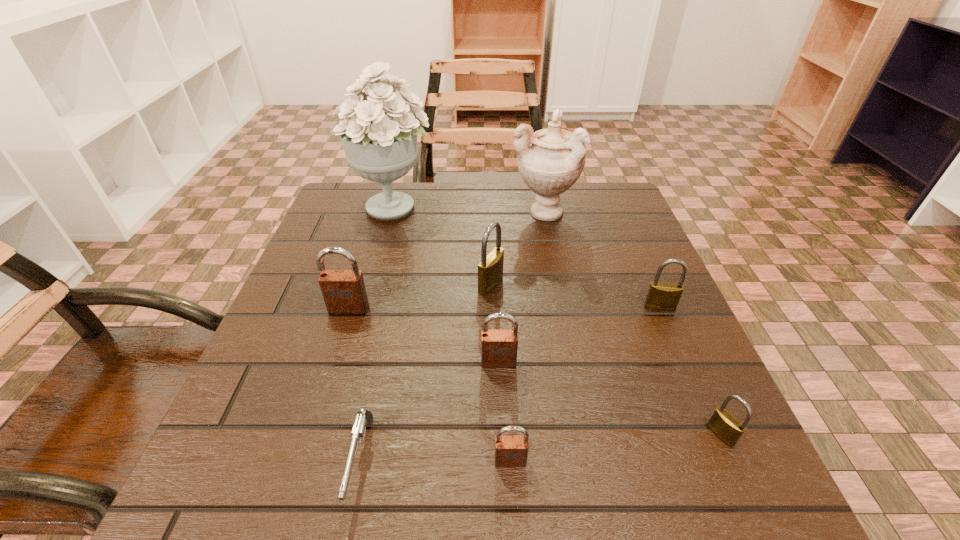
I want to click on object that stands as the seventh closest to the seventh nearest object, so click(510, 451).

Identify which object is located as the eighth nearest to the shortest object. Please provide its 2D coordinates. Your answer should be formatted as a tuple, i.e. [(x, y)], where the tuple contains the x and y coordinates of a point satisfying the conditions above.

[(550, 161)]

Find the location of a particular element. The height and width of the screenshot is (540, 960). padlock that is the closest to the pistol is located at coordinates (510, 451).

Where is `the fourth closest padlock to the green bouquet`? The width and height of the screenshot is (960, 540). the fourth closest padlock to the green bouquet is located at coordinates (661, 296).

Find the location of a particular element. This screenshot has width=960, height=540. brass padlock that is the closest to the biggest brown padlock is located at coordinates (490, 270).

Locate which brass padlock is the second closest to the pistol. Please provide its 2D coordinates. Your answer should be formatted as a tuple, i.e. [(x, y)], where the tuple contains the x and y coordinates of a point satisfying the conditions above.

[(724, 426)]

The width and height of the screenshot is (960, 540). Identify the location of brown padlock identified as the third closest to the leftmost brass padlock. (510, 451).

Locate an element on the screen. This screenshot has height=540, width=960. brown padlock identified as the closest to the biggest brass padlock is located at coordinates [x=499, y=348].